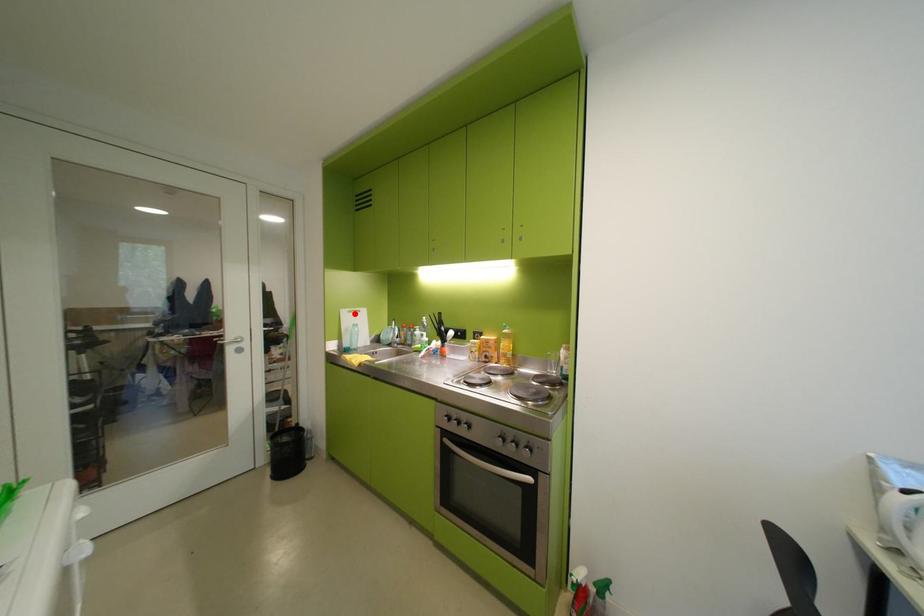
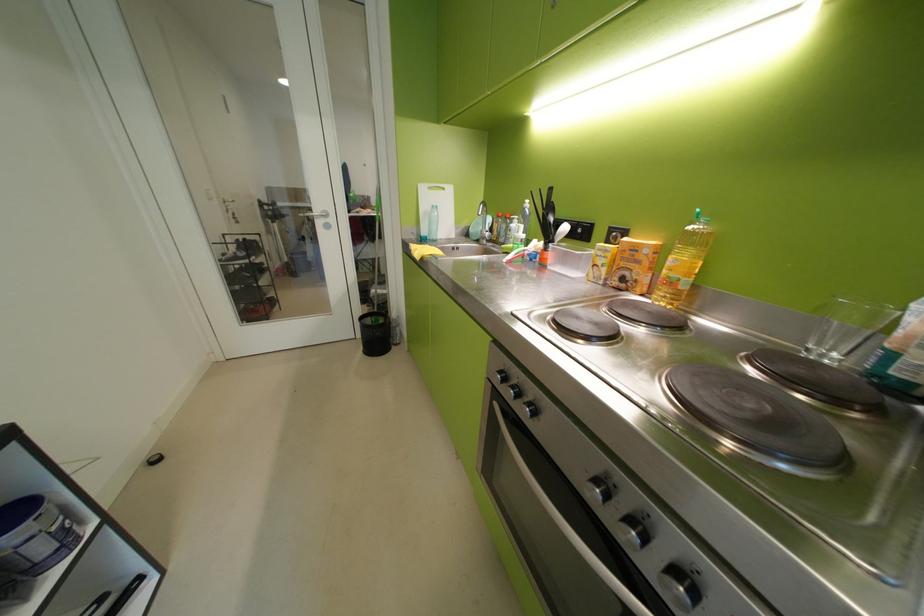
Find the pixel in the second image that matches the highlighted location in the first image.

(433, 190)